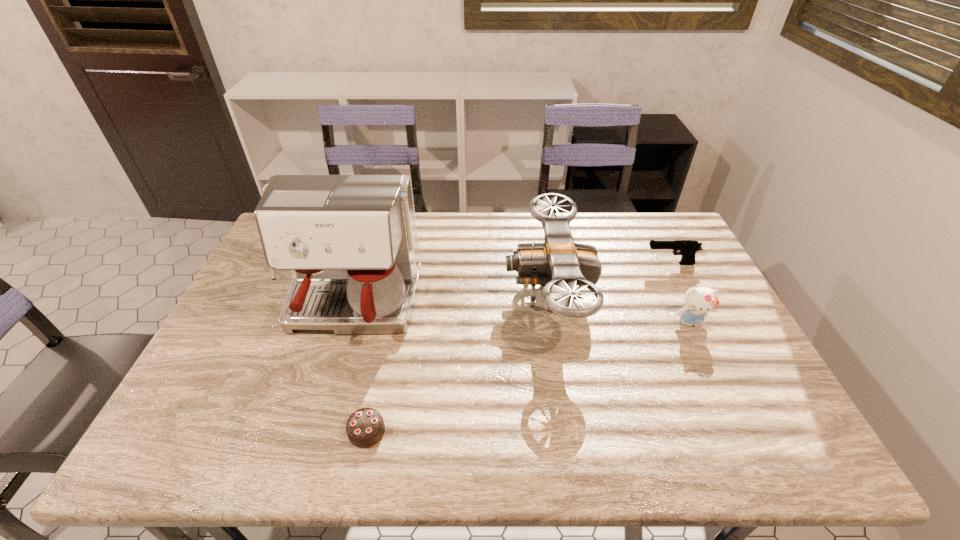
In order to click on free space between the coffee maker and the fourth shortest object in this screenshot , I will do `click(449, 301)`.

You are a GUI agent. You are given a task and a screenshot of the screen. Output one action in this format:
    pyautogui.click(x=<x>, y=<y>)
    Task: Click on the free space between the drone and the coffee maker
    The height and width of the screenshot is (540, 960).
    Given the screenshot: What is the action you would take?
    pyautogui.click(x=449, y=301)

You are a GUI agent. You are given a task and a screenshot of the screen. Output one action in this format:
    pyautogui.click(x=<x>, y=<y>)
    Task: Click on the vacant area that lies between the fourth tallest object and the third shortest object
    
    Given the screenshot: What is the action you would take?
    pyautogui.click(x=680, y=293)

Where is `free space between the shortest object and the third tallest object`? free space between the shortest object and the third tallest object is located at coordinates 528,377.

This screenshot has width=960, height=540. I want to click on free space between the coffee maker and the fourth tallest object, so click(x=510, y=286).

Point out which object is positioned as the nearest to the third object from left to right. Please provide its 2D coordinates. Your answer should be formatted as a tuple, i.e. [(x, y)], where the tuple contains the x and y coordinates of a point satisfying the conditions above.

[(688, 248)]

Locate an element on the screen. object that is the closest to the kitten is located at coordinates (688, 248).

Image resolution: width=960 pixels, height=540 pixels. Find the location of `vacant position in the image that satisfies the following two spatial constraints: 1. on the front-facing side of the pistol; 2. on the front-facing side of the third shortest object`. vacant position in the image that satisfies the following two spatial constraints: 1. on the front-facing side of the pistol; 2. on the front-facing side of the third shortest object is located at coordinates (699, 322).

Where is `vacant area that satisfies the following two spatial constraints: 1. on the front-facing side of the second shortest object; 2. on the front side of the shortest object`? The width and height of the screenshot is (960, 540). vacant area that satisfies the following two spatial constraints: 1. on the front-facing side of the second shortest object; 2. on the front side of the shortest object is located at coordinates (753, 431).

Locate an element on the screen. The image size is (960, 540). free location that satisfies the following two spatial constraints: 1. on the front-facing side of the pistol; 2. on the front-facing side of the third shortest object is located at coordinates (699, 322).